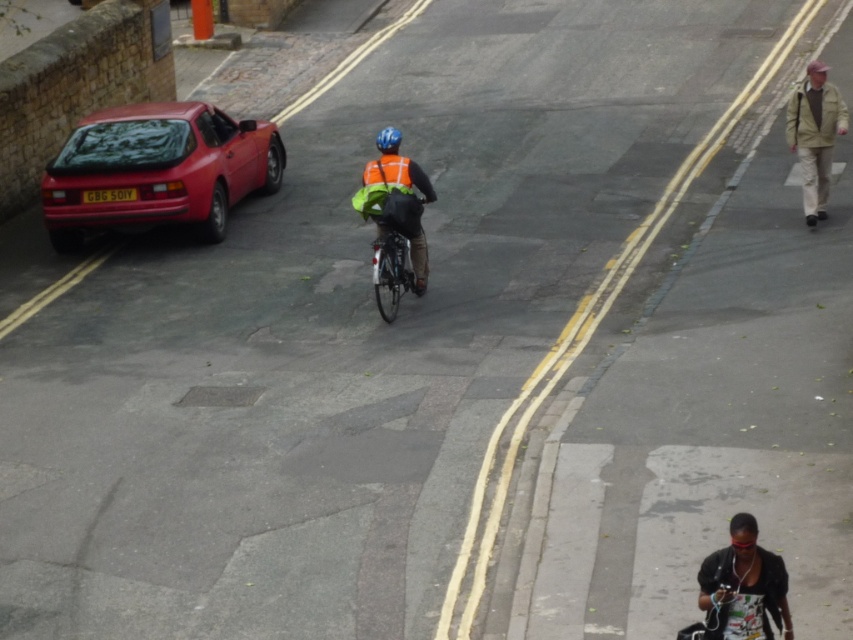
Can you confirm if orange reflective safety vest at center is wider than blue matte helmet at center?

Incorrect, orange reflective safety vest at center's width does not surpass blue matte helmet at center's.

Which is in front, point (367, 179) or point (399, 134)?

Point (399, 134) is more forward.

Is point (405, 164) more distant than point (389, 134)?

Yes, point (405, 164) is behind point (389, 134).

This screenshot has height=640, width=853. Find the location of `orange reflective safety vest at center`. orange reflective safety vest at center is located at coordinates (387, 172).

Does reflective orange vest at center appear on the right side of orange reflective safety vest at center?

Correct, you'll find reflective orange vest at center to the right of orange reflective safety vest at center.

Locate an element on the screen. Image resolution: width=853 pixels, height=640 pixels. reflective orange vest at center is located at coordinates pyautogui.click(x=397, y=198).

Who is lower down, shiny red car at left or black fabric headphones at lower right?

black fabric headphones at lower right

Find the location of a particular element. The height and width of the screenshot is (640, 853). shiny red car at left is located at coordinates (155, 170).

The width and height of the screenshot is (853, 640). Find the location of `shiny red car at left`. shiny red car at left is located at coordinates (155, 170).